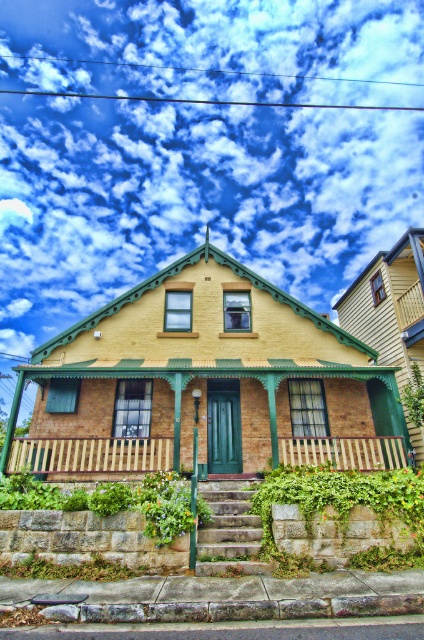
Is wooden slats at lower center to the right of wooden at center from the viewer's perspective?

No, wooden slats at lower center is not to the right of wooden at center.

Between point (25, 440) and point (351, 452), which one is positioned in front?

Point (351, 452)

Find the location of a particular element. The image size is (424, 640). wooden slats at lower center is located at coordinates (89, 454).

Is cloudy sky at upper center bigger than wooden planks at center?

Yes, cloudy sky at upper center is bigger than wooden planks at center.

The width and height of the screenshot is (424, 640). Identify the location of cloudy sky at upper center. (190, 198).

This screenshot has height=640, width=424. I want to click on cloudy sky at upper center, so click(190, 198).

Is cloudy sky at upper center shorter than wooden slats at lower center?

In fact, cloudy sky at upper center may be taller than wooden slats at lower center.

Who is positioned more to the right, cloudy sky at upper center or wooden slats at lower center?

cloudy sky at upper center

Does point (22, 148) come behind point (98, 449)?

Yes, it is.

Image resolution: width=424 pixels, height=640 pixels. Identify the location of cloudy sky at upper center. (190, 198).